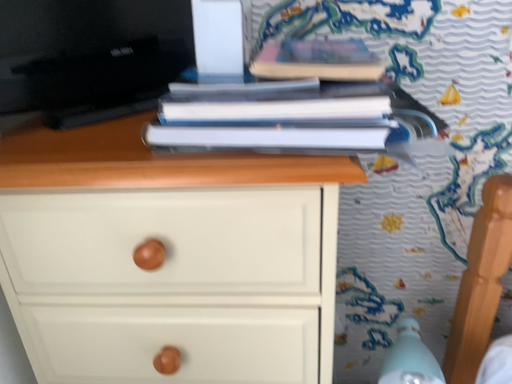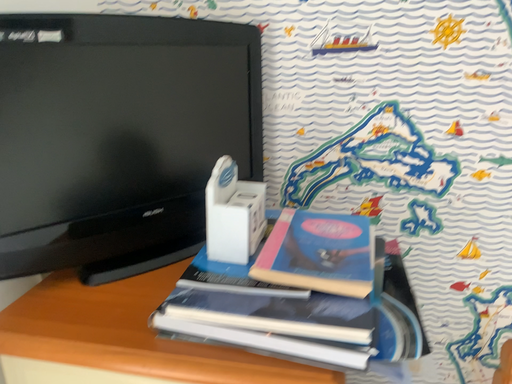
Question: Which way did the camera rotate in the video?

Choices:
 (A) rotated left
 (B) rotated right

Answer: (A)